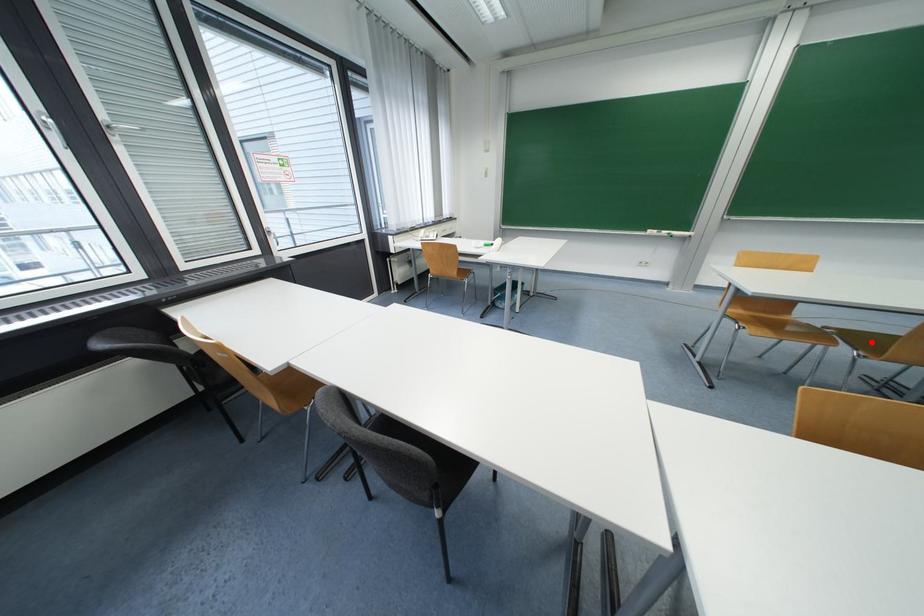
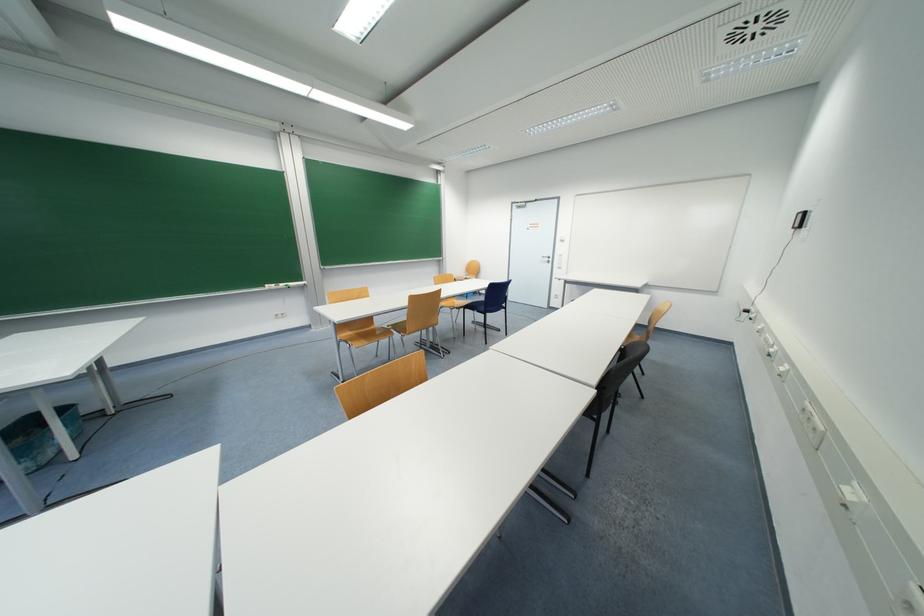
Find the pixel in the second image that matches the highlighted location in the first image.

(405, 329)